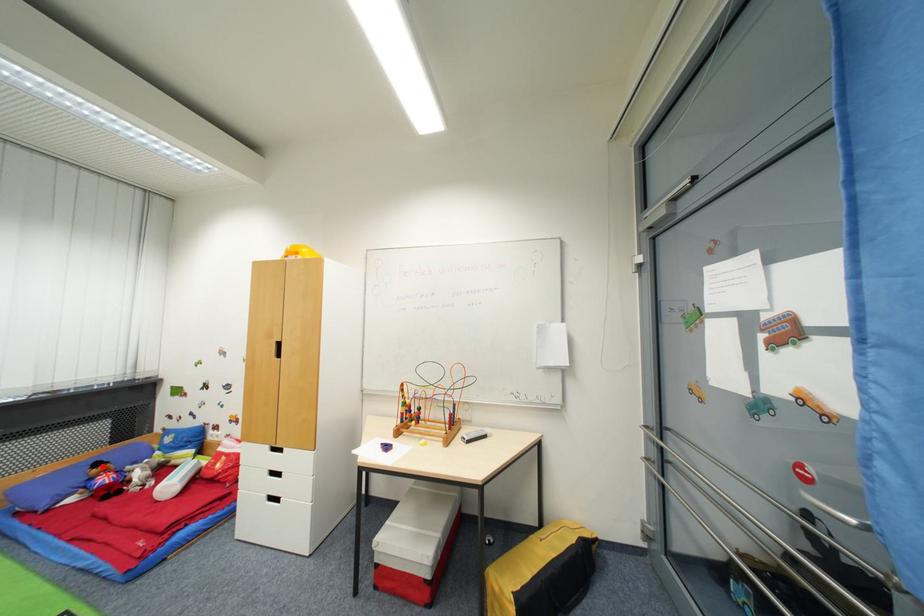
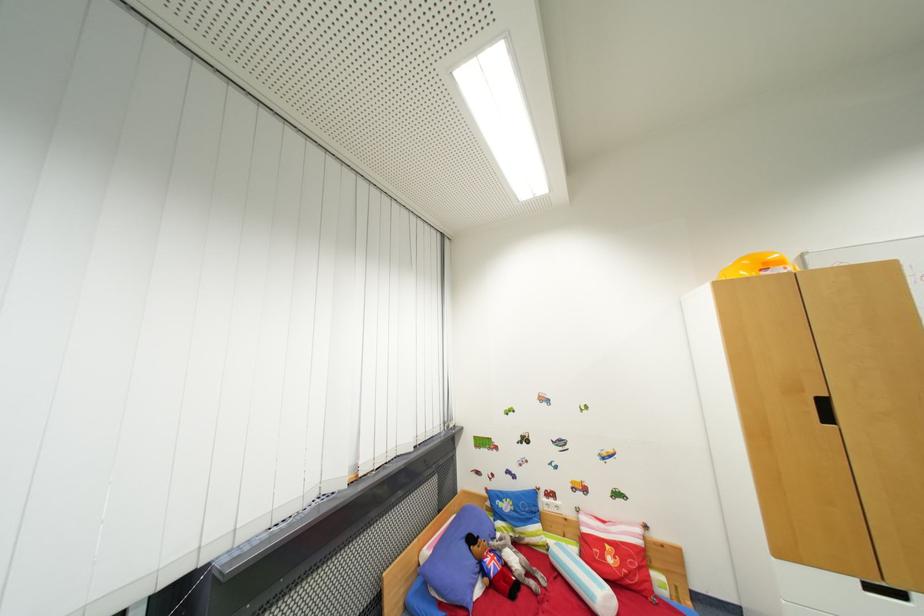
In the second image, find the point that corresponds to the highlighted location in the first image.

(477, 541)